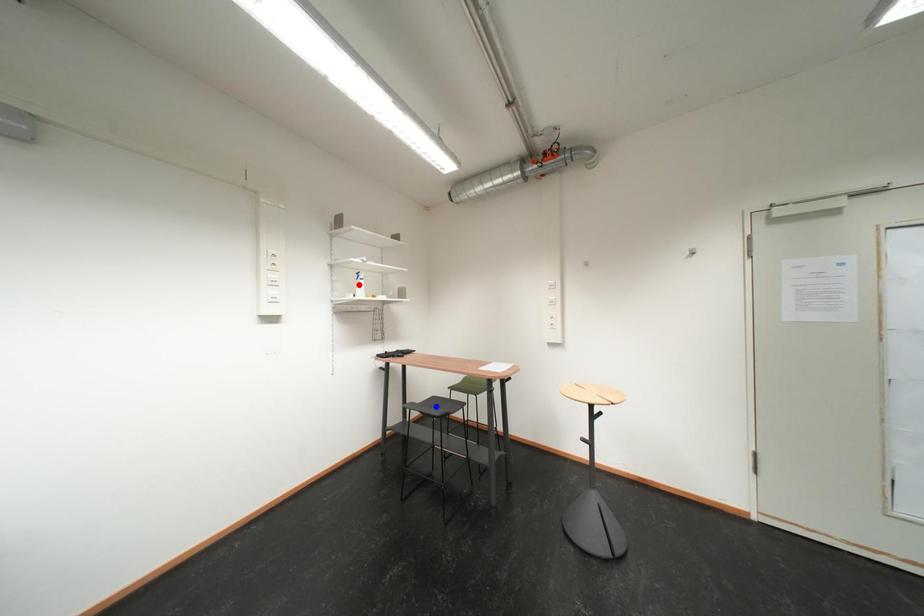
Question: Which of the two points in the image is closer to the camera?

Choices:
 (A) Blue point is closer.
 (B) Red point is closer.

Answer: (A)